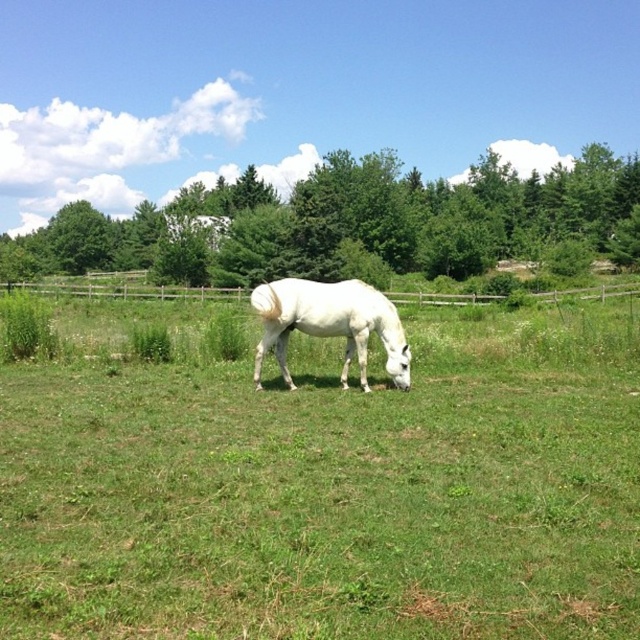
Question: Is green grassy at center further to camera compared to white glossy horse at center?

Choices:
 (A) yes
 (B) no

Answer: (B)

Question: Which point is farther to the camera?

Choices:
 (A) wooden fence at center
 (B) white glossy horse at center
 (C) green grassy at center

Answer: (A)

Question: Is white glossy horse at center above wooden fence at center?

Choices:
 (A) yes
 (B) no

Answer: (B)

Question: Is white glossy horse at center bigger than wooden fence at center?

Choices:
 (A) yes
 (B) no

Answer: (B)

Question: Which of the following is the farthest from the observer?

Choices:
 (A) wooden fence at center
 (B) white glossy horse at center
 (C) green grassy at center

Answer: (A)

Question: Which point is closer to the camera?

Choices:
 (A) wooden fence at center
 (B) green grassy at center
 (C) white glossy horse at center

Answer: (B)